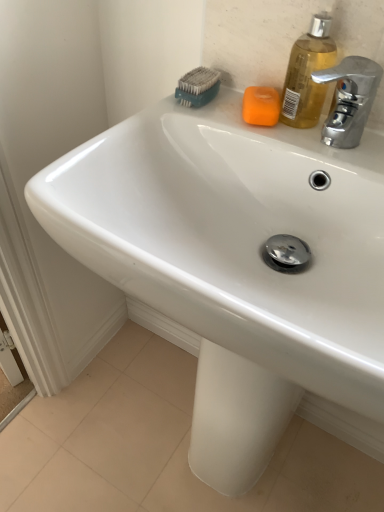
Find the location of a particular element. The height and width of the screenshot is (512, 384). teal plastic brush at upper center is located at coordinates (198, 87).

This screenshot has height=512, width=384. What are the coordinates of `orange matte soap at upper center` in the screenshot? It's located at (261, 106).

Consider the image. From a real-world perspective, is teal plastic brush at upper center located beneath orange matte soap at upper center?

No.

You are a GUI agent. You are given a task and a screenshot of the screen. Output one action in this format:
    pyautogui.click(x=<x>, y=<y>)
    Task: Click on the brush located on the left of orange matte soap at upper center
    The image size is (384, 512).
    Given the screenshot: What is the action you would take?
    pyautogui.click(x=198, y=87)

Between point (200, 77) and point (255, 86), which one is positioned in front?

Positioned in front is point (255, 86).

Considering the relative positions of teal plastic brush at upper center and orange matte soap at upper center in the image provided, is teal plastic brush at upper center to the left of orange matte soap at upper center from the viewer's perspective?

Yes, teal plastic brush at upper center is to the left of orange matte soap at upper center.

How different are the orientations of orange matte soap at upper center and translucent yellow liquid at upper right in degrees?

20.4 degrees.

Is orange matte soap at upper center facing towards translucent yellow liquid at upper right?

No, orange matte soap at upper center is not facing towards translucent yellow liquid at upper right.

Which of these two, orange matte soap at upper center or translucent yellow liquid at upper right, stands taller?

translucent yellow liquid at upper right.

Looking at this image, visually, is orange matte soap at upper center positioned to the left or to the right of translucent yellow liquid at upper right?

orange matte soap at upper center is positioned on translucent yellow liquid at upper right's left side.

In the image, there is a teal plastic brush at upper center. Where is `soap below it (from the image's perspective)`? soap below it (from the image's perspective) is located at coordinates (261, 106).

Does orange matte soap at upper center lie behind teal plastic brush at upper center?

No, orange matte soap at upper center is closer to the viewer.

Based on the photo, from the image's perspective, relative to teal plastic brush at upper center, is orange matte soap at upper center above or below?

Clearly, from the image's perspective, orange matte soap at upper center is below teal plastic brush at upper center.

The width and height of the screenshot is (384, 512). What are the coordinates of `soap dispenser on the right of teal plastic brush at upper center` in the screenshot? It's located at (307, 74).

Is teal plastic brush at upper center positioned behind translucent yellow liquid at upper right?

Yes, it is.

Based on their sizes in the image, would you say teal plastic brush at upper center is bigger or smaller than translucent yellow liquid at upper right?

In the image, teal plastic brush at upper center appears to be smaller than translucent yellow liquid at upper right.

Which is more to the right, teal plastic brush at upper center or translucent yellow liquid at upper right?

Positioned to the right is translucent yellow liquid at upper right.

Is translucent yellow liquid at upper right oriented towards orange matte soap at upper center?

No, translucent yellow liquid at upper right is not oriented towards orange matte soap at upper center.

From the picture: Which object is wider, translucent yellow liquid at upper right or orange matte soap at upper center?

orange matte soap at upper center.

How different are the orientations of translucent yellow liquid at upper right and orange matte soap at upper center in degrees?

The angle between the facing direction of translucent yellow liquid at upper right and the facing direction of orange matte soap at upper center is 20.4 degrees.

Which object is further away from the camera taking this photo, translucent yellow liquid at upper right or orange matte soap at upper center?

orange matte soap at upper center is further from the camera.

In the scene shown: Considering the sizes of objects translucent yellow liquid at upper right and teal plastic brush at upper center in the image provided, who is thinner, translucent yellow liquid at upper right or teal plastic brush at upper center?

Thinner between the two is translucent yellow liquid at upper right.

From the image's perspective, relative to teal plastic brush at upper center, is translucent yellow liquid at upper right above or below?

translucent yellow liquid at upper right is below teal plastic brush at upper center.

Considering the positions of points (318, 41) and (182, 99), is point (318, 41) farther from camera compared to point (182, 99)?

No, it is not.

You are a GUI agent. You are given a task and a screenshot of the screen. Output one action in this format:
    pyautogui.click(x=<x>, y=<y>)
    Task: Click on the brush on the left of orange matte soap at upper center
    This screenshot has width=384, height=512.
    Given the screenshot: What is the action you would take?
    pyautogui.click(x=198, y=87)

Image resolution: width=384 pixels, height=512 pixels. I want to click on soap behind the translucent yellow liquid at upper right, so click(x=261, y=106).

Which object lies nearer to the anchor point teal plastic brush at upper center, translucent yellow liquid at upper right or orange matte soap at upper center?

orange matte soap at upper center is positioned closer to the anchor teal plastic brush at upper center.

Considering their positions, is orange matte soap at upper center positioned closer to translucent yellow liquid at upper right than teal plastic brush at upper center?

Among the two, orange matte soap at upper center is located nearer to translucent yellow liquid at upper right.

When comparing their distances from orange matte soap at upper center, does translucent yellow liquid at upper right or teal plastic brush at upper center seem further?

teal plastic brush at upper center is positioned further to the anchor orange matte soap at upper center.

Considering their positions, is teal plastic brush at upper center positioned closer to orange matte soap at upper center than translucent yellow liquid at upper right?

translucent yellow liquid at upper right is closer to orange matte soap at upper center.

Estimate the real-world distances between objects in this image. Which object is further from teal plastic brush at upper center, orange matte soap at upper center or translucent yellow liquid at upper right?

translucent yellow liquid at upper right is positioned further to the anchor teal plastic brush at upper center.

From the image, which object appears to be nearer to translucent yellow liquid at upper right, teal plastic brush at upper center or orange matte soap at upper center?

Based on the image, orange matte soap at upper center appears to be nearer to translucent yellow liquid at upper right.

At what (x,y) coordinates should I click in order to perform the action: click on soap located between teal plastic brush at upper center and translucent yellow liquid at upper right in the left-right direction. Please return your answer as a coordinate pair (x, y). This screenshot has height=512, width=384. Looking at the image, I should click on (261, 106).